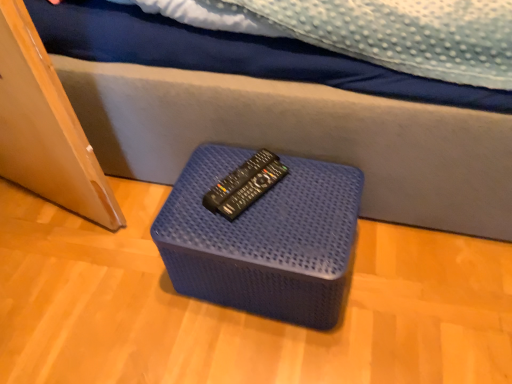
The image size is (512, 384). I want to click on unoccupied region to the right of black plastic remote at center, so click(313, 185).